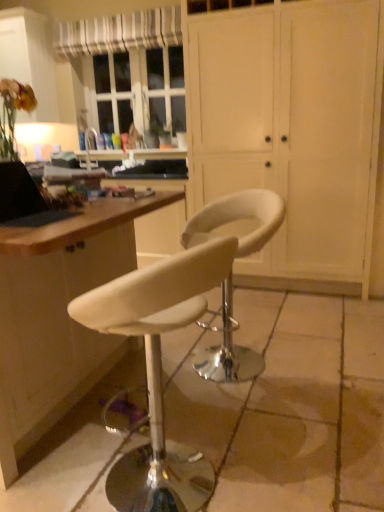
This screenshot has height=512, width=384. In order to click on vacant space in between white leather stool at center, which appears as the 2th chair when viewed from the back, and white leather stool at center, which appears as the first chair when viewed from the back in this screenshot , I will do `click(213, 406)`.